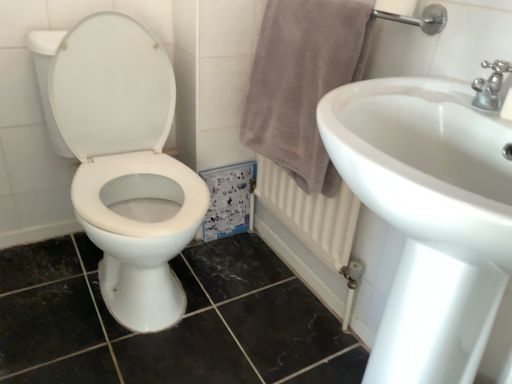
Where is `unoccupied area in front of white glossy toilet at left`? unoccupied area in front of white glossy toilet at left is located at coordinates (99, 348).